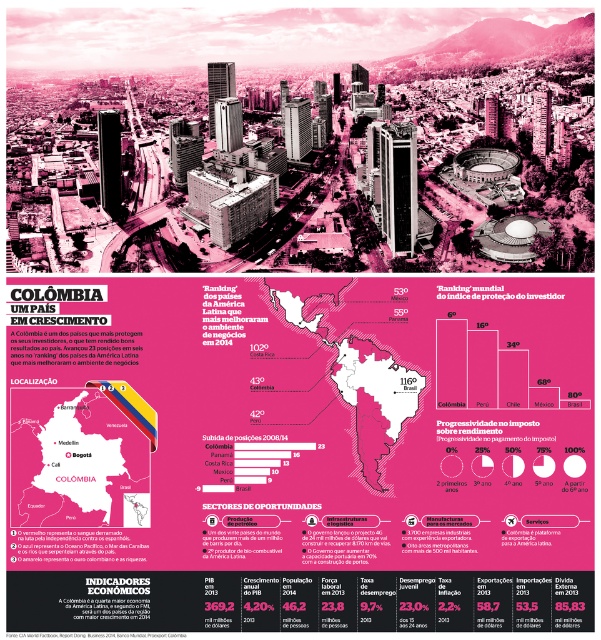
Between point (81, 506) and point (300, 330), which one is positioned behind?

The point (300, 330) is behind.

Is matte black map at center below pink paper map at center?

Yes, matte black map at center is below pink paper map at center.

The image size is (601, 640). In order to click on matte black map at center in this screenshot , I will do `click(79, 456)`.

Image resolution: width=601 pixels, height=640 pixels. Identify the location of matte black map at center. (79, 456).